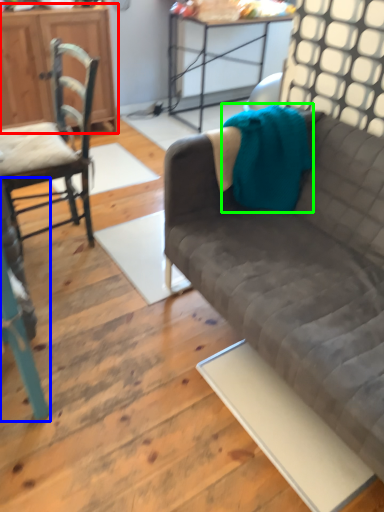
Question: Which is farther away from cabinetry (highlighted by a red box)? chair (highlighted by a blue box) or blanket (highlighted by a green box)?

Choices:
 (A) chair
 (B) blanket

Answer: (A)